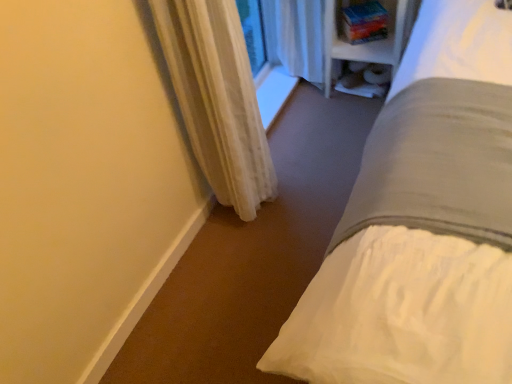
Question: Does point (343, 82) appear closer or farther from the camera than point (246, 114)?

Choices:
 (A) farther
 (B) closer

Answer: (A)

Question: In terms of size, does white fabric shelf at upper right appear bigger or smaller than white sheer curtain at lower left?

Choices:
 (A) small
 (B) big

Answer: (A)

Question: Which of these objects is positioned closest to the white plastic bookshelf at upper right?

Choices:
 (A) white sheer curtain at lower left
 (B) white fabric shelf at upper right

Answer: (B)

Question: Which is farther from the white plastic bookshelf at upper right?

Choices:
 (A) white fabric shelf at upper right
 (B) white sheer curtain at lower left

Answer: (B)